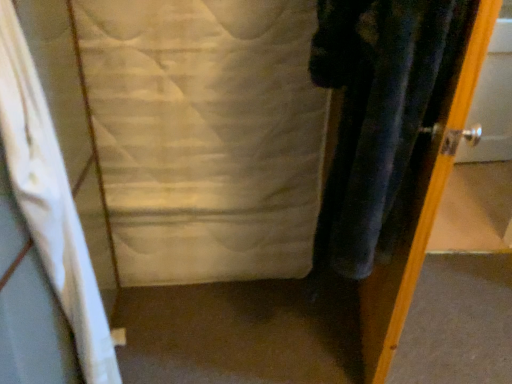
Question: Should I look upward or downward to see white quilted fabric at center?

Choices:
 (A) down
 (B) up

Answer: (B)

Question: From the image's perspective, is metallic silver door at right on white quilted fabric at center?

Choices:
 (A) no
 (B) yes

Answer: (A)

Question: From a real-world perspective, does metallic silver door at right sit lower than white quilted fabric at center?

Choices:
 (A) no
 (B) yes

Answer: (A)

Question: Are metallic silver door at right and white quilted fabric at center making contact?

Choices:
 (A) yes
 (B) no

Answer: (B)

Question: Is the position of metallic silver door at right more distant than that of white quilted fabric at center?

Choices:
 (A) no
 (B) yes

Answer: (A)

Question: Is white quilted fabric at center at the back of metallic silver door at right?

Choices:
 (A) yes
 (B) no

Answer: (A)

Question: Does metallic silver door at right come in front of white quilted fabric at center?

Choices:
 (A) no
 (B) yes

Answer: (B)

Question: Considering the relative sizes of white fabric curtain at left and white quilted fabric at center in the image provided, is white fabric curtain at left thinner than white quilted fabric at center?

Choices:
 (A) no
 (B) yes

Answer: (A)

Question: Considering the relative positions of white fabric curtain at left and white quilted fabric at center in the image provided, is white fabric curtain at left to the left of white quilted fabric at center from the viewer's perspective?

Choices:
 (A) no
 (B) yes

Answer: (B)

Question: Is white fabric curtain at left oriented away from white quilted fabric at center?

Choices:
 (A) yes
 (B) no

Answer: (B)

Question: Is white fabric curtain at left positioned in front of white quilted fabric at center?

Choices:
 (A) no
 (B) yes

Answer: (B)

Question: Can you confirm if white fabric curtain at left is positioned to the right of white quilted fabric at center?

Choices:
 (A) no
 (B) yes

Answer: (A)

Question: Considering the relative sizes of white fabric curtain at left and white quilted fabric at center in the image provided, is white fabric curtain at left bigger than white quilted fabric at center?

Choices:
 (A) yes
 (B) no

Answer: (B)

Question: Does white quilted fabric at center have a greater height compared to white fabric curtain at left?

Choices:
 (A) yes
 (B) no

Answer: (B)